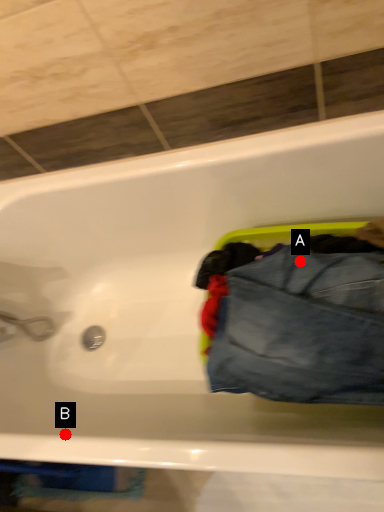
Question: Two points are circled on the image, labeled by A and B beside each circle. Among these points, which one is farthest from the camera?

Choices:
 (A) A is further
 (B) B is further

Answer: (B)